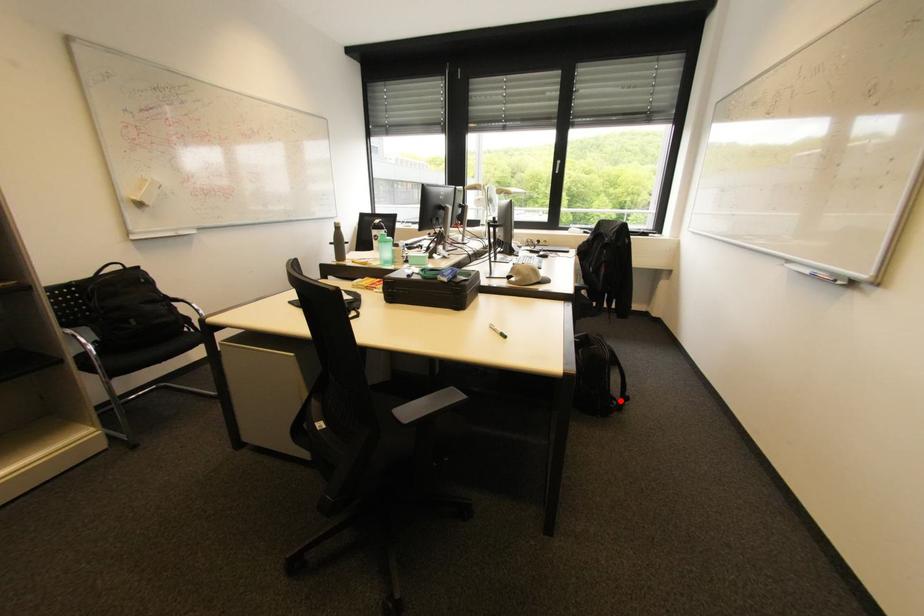
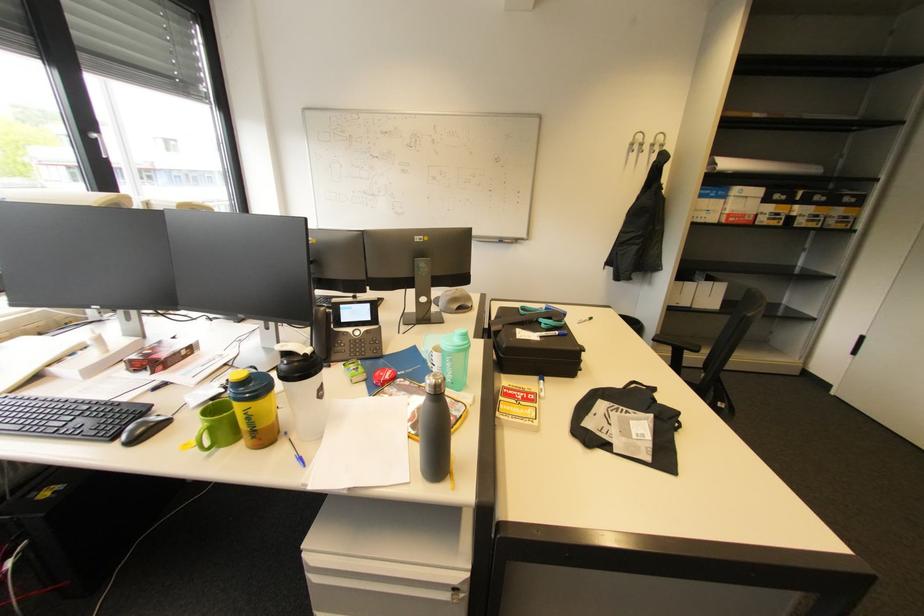
Question: I am providing you with two images of the same scene from different viewpoints. A red point is marked on the first image. Can you still see the location of the red point in image 2?

Choices:
 (A) Yes
 (B) No

Answer: (B)